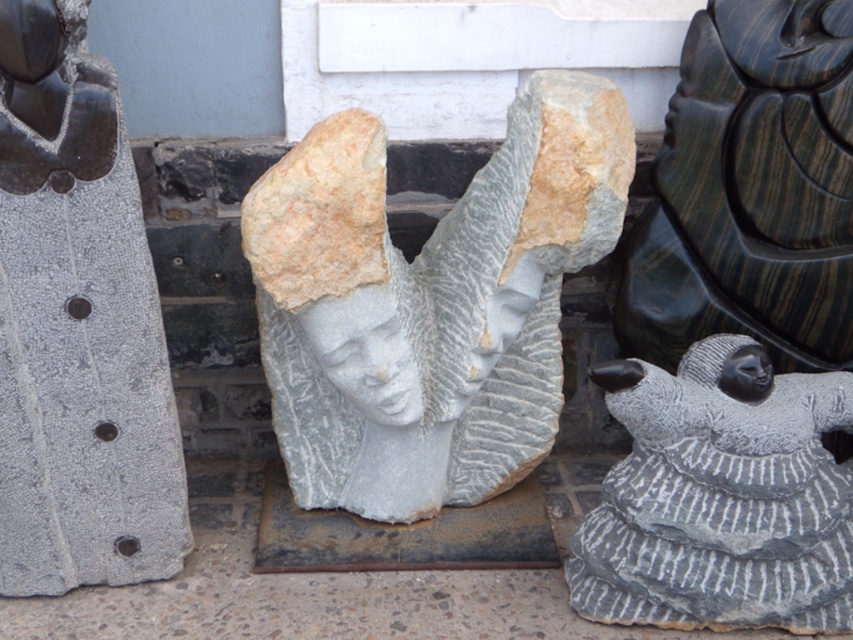
Is point (45, 1) positioned after point (752, 352)?

No, it is in front of (752, 352).

Between black glossy head at upper left and black stone head at center, which one appears on the left side from the viewer's perspective?

From the viewer's perspective, black glossy head at upper left appears more on the left side.

Does point (51, 67) lie in front of point (712, 372)?

Yes, point (51, 67) is closer to viewer.

You are a GUI agent. You are given a task and a screenshot of the screen. Output one action in this format:
    pyautogui.click(x=<x>, y=<y>)
    Task: Click on the black glossy head at upper left
    This screenshot has width=853, height=640.
    Given the screenshot: What is the action you would take?
    pyautogui.click(x=38, y=35)

Between gray stone statue at center and black stone head at center, which one has less height?

black stone head at center

Between gray stone statue at center and black stone head at center, which one is positioned higher?

Positioned higher is gray stone statue at center.

Between point (102, 64) and point (728, 372), which one is positioned behind?

The point (728, 372) is more distant.

Locate an element on the screen. The height and width of the screenshot is (640, 853). gray stone statue at center is located at coordinates (77, 326).

Looking at this image, between gray stone sculpture at center and black glossy head at upper left, which one is positioned lower?

Positioned lower is gray stone sculpture at center.

The width and height of the screenshot is (853, 640). What are the coordinates of `gray stone sculpture at center` in the screenshot? It's located at (428, 301).